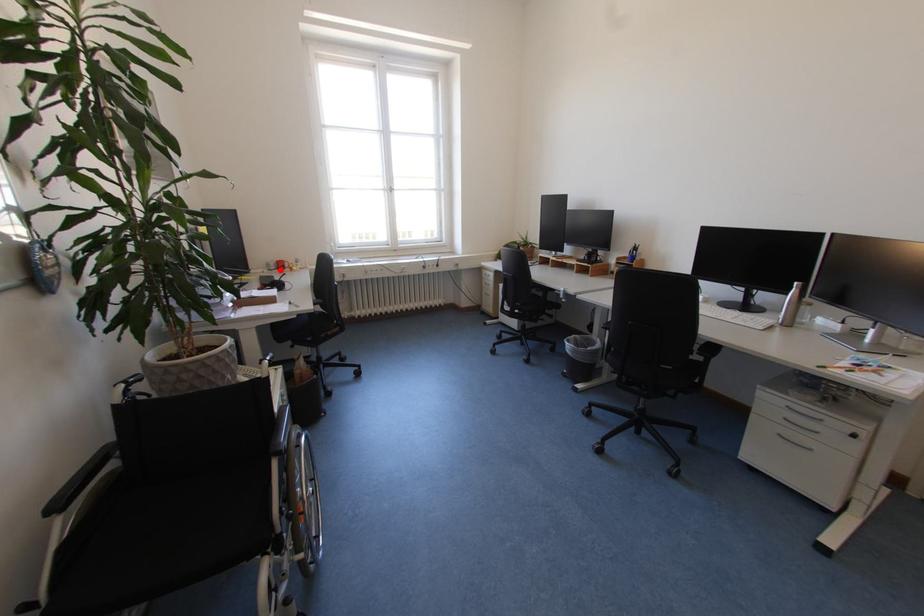
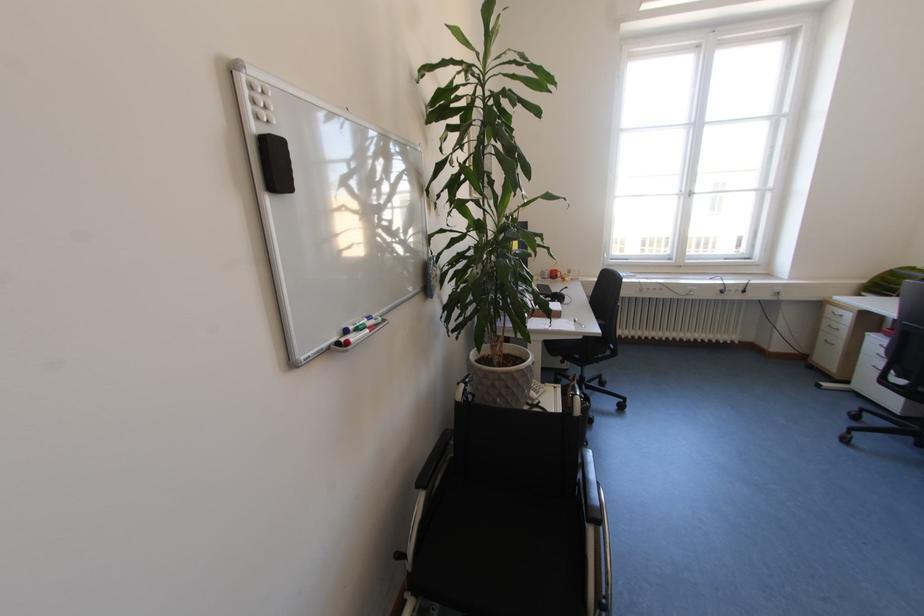
The point at the highlighted location is marked in the first image. Where is the corresponding point in the second image?

(553, 278)